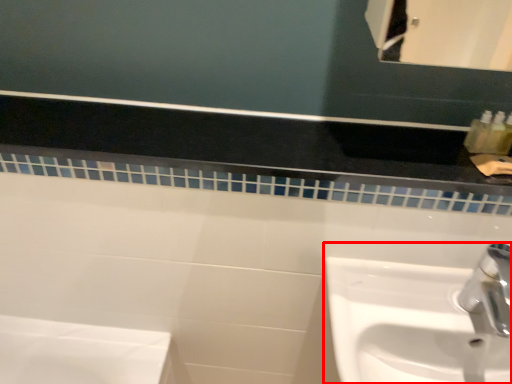
Question: Where is sink (annotated by the red box) located in relation to balustrade in the image?

Choices:
 (A) right
 (B) left

Answer: (A)